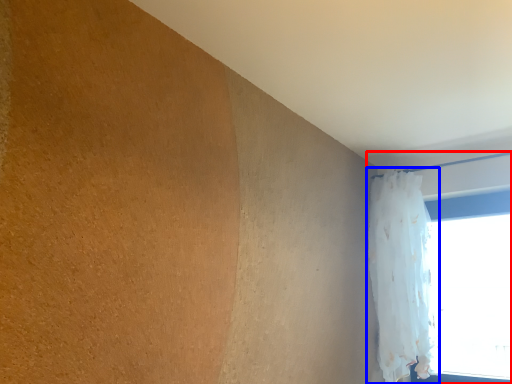
Question: Which of the following is the closest to the observer, window (highlighted by a red box) or curtain (highlighted by a blue box)?

Choices:
 (A) window
 (B) curtain

Answer: (B)